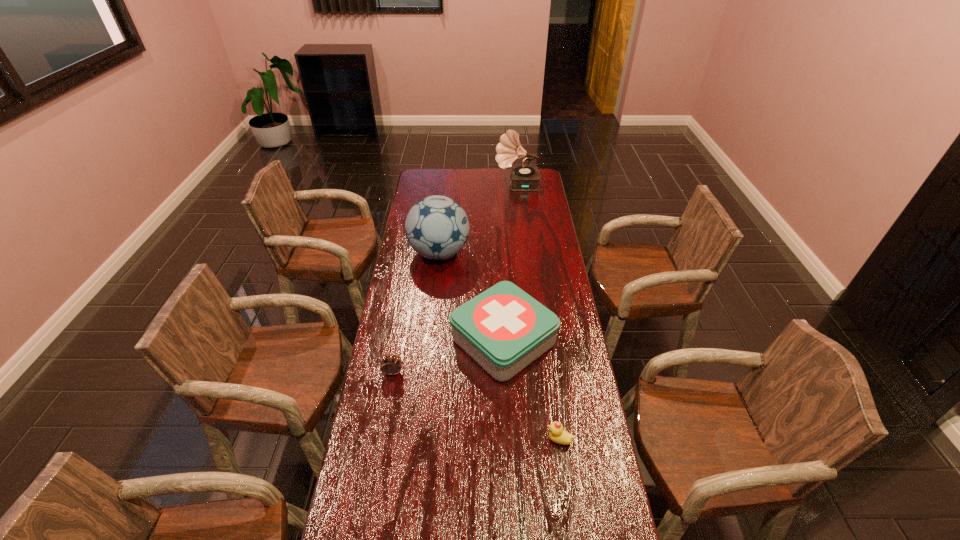
The height and width of the screenshot is (540, 960). Identify the location of vacant point located between the farthest object and the fourth nearest object. (478, 219).

Where is `vacant space that's between the farthest object and the alarm clock`? This screenshot has width=960, height=540. vacant space that's between the farthest object and the alarm clock is located at coordinates 455,279.

Identify which object is the closest to the fourth tallest object. Please provide its 2D coordinates. Your answer should be formatted as a tuple, i.e. [(x, y)], where the tuple contains the x and y coordinates of a point satisfying the conditions above.

[(504, 329)]

Locate which object is the closest to the farthest object. Please provide its 2D coordinates. Your answer should be formatted as a tuple, i.e. [(x, y)], where the tuple contains the x and y coordinates of a point satisfying the conditions above.

[(437, 227)]

Locate an element on the screen. free spot that satisfies the following two spatial constraints: 1. from the horn of the farthest object; 2. on the front side of the third shortest object is located at coordinates (536, 341).

Where is `vacant region that satisfies the following two spatial constraints: 1. on the side with brand of the soccer ball; 2. on the face of the alarm clock`? The height and width of the screenshot is (540, 960). vacant region that satisfies the following two spatial constraints: 1. on the side with brand of the soccer ball; 2. on the face of the alarm clock is located at coordinates (426, 373).

Where is `vacant position in the image that satisfies the following two spatial constraints: 1. on the side with brand of the fourth shortest object; 2. on the back side of the third shortest object`? This screenshot has width=960, height=540. vacant position in the image that satisfies the following two spatial constraints: 1. on the side with brand of the fourth shortest object; 2. on the back side of the third shortest object is located at coordinates (430, 341).